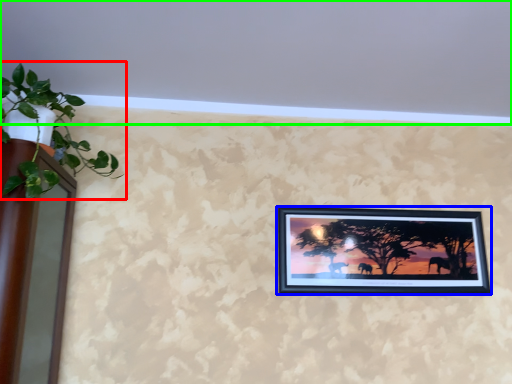
Question: Estimate the real-world distances between objects in this image. Which object is closer to houseplant (highlighted by a red box), picture frame (highlighted by a blue box) or backdrop (highlighted by a green box)?

Choices:
 (A) picture frame
 (B) backdrop

Answer: (B)